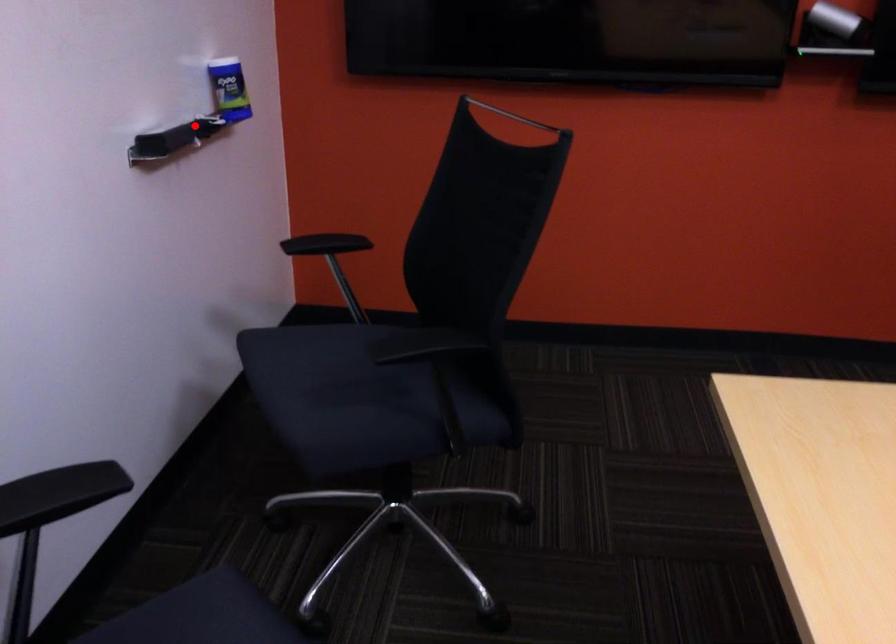
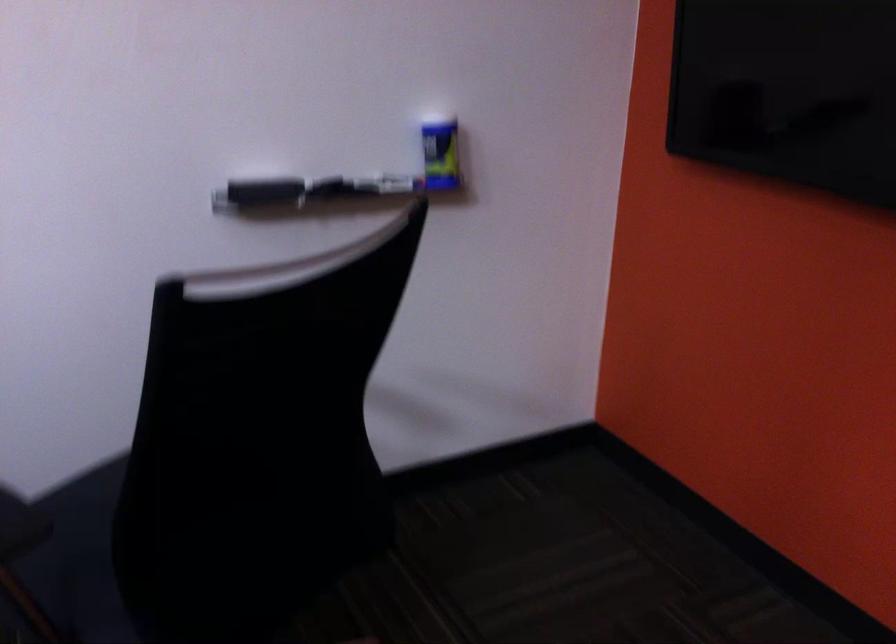
The point at the highlighted location is marked in the first image. Where is the corresponding point in the second image?

(355, 181)